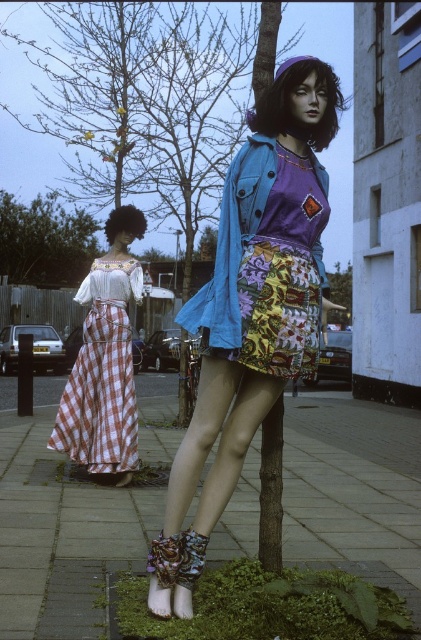
Question: Can you confirm if green textured tree at center is wider than green leafy tree at upper left?

Choices:
 (A) yes
 (B) no

Answer: (A)

Question: Can you confirm if matte blue denim jacket at center is positioned to the right of denim jacket at center?

Choices:
 (A) no
 (B) yes

Answer: (A)

Question: Which point is closer to the camera?

Choices:
 (A) (199, 296)
 (B) (141, 147)

Answer: (A)

Question: Which of these objects is positioned closest to the smooth concrete pavement at center?

Choices:
 (A) green leafy tree at upper left
 (B) denim jacket at center
 (C) matte blue denim jacket at center

Answer: (C)

Question: Considering the relative positions of matte blue denim jacket at center and checkered fabric dress at left in the image provided, where is matte blue denim jacket at center located with respect to checkered fabric dress at left?

Choices:
 (A) left
 (B) right

Answer: (B)

Question: Among these objects, which one is nearest to the camera?

Choices:
 (A) denim jacket at center
 (B) checkered fabric dress at left
 (C) matte blue denim jacket at center
 (D) green leafy tree at upper left

Answer: (C)